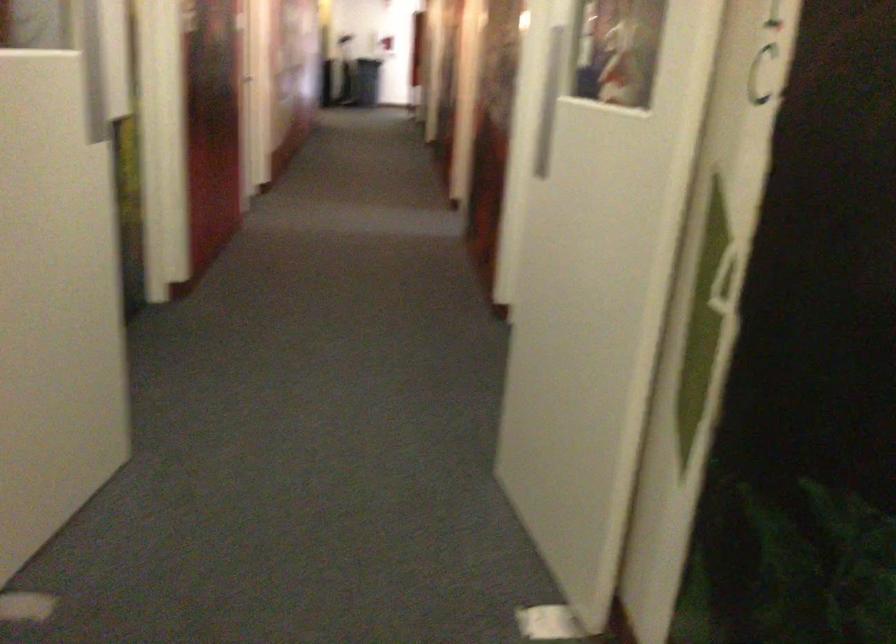
Describe the element at coordinates (547, 104) in the screenshot. The image size is (896, 644). I see `the vertical door handle` at that location.